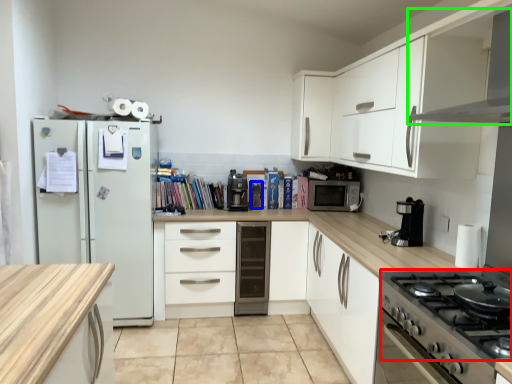
Question: Considering the real-world distances, which object is farthest from gas stove (highlighted by a red box)? appliance (highlighted by a blue box) or exhaust hood (highlighted by a green box)?

Choices:
 (A) appliance
 (B) exhaust hood

Answer: (A)